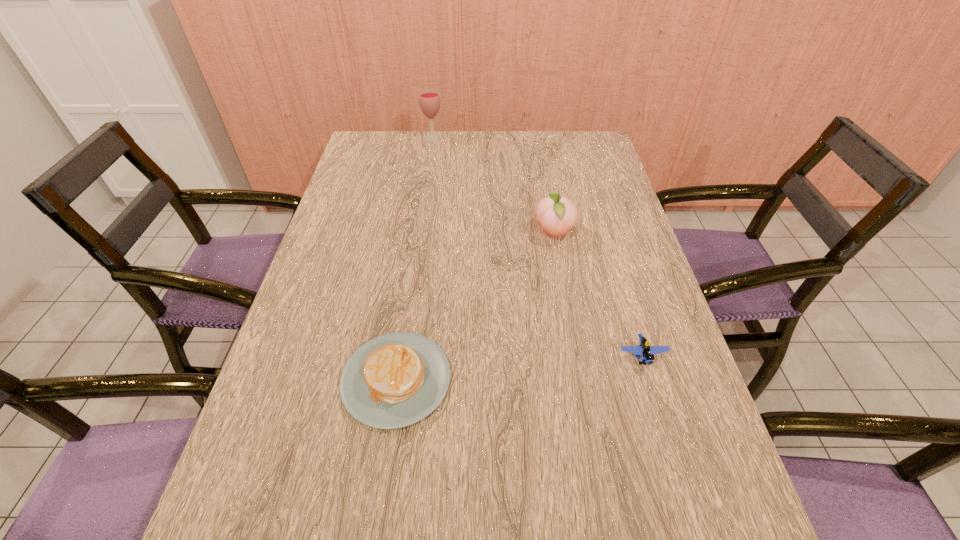
The width and height of the screenshot is (960, 540). Find the location of `wineglass`. wineglass is located at coordinates (429, 100).

Locate an element on the screen. the farthest object is located at coordinates (429, 100).

Find the location of a particular element. Image resolution: width=960 pixels, height=540 pixels. the second farthest object is located at coordinates (557, 215).

Locate an element on the screen. the third shortest object is located at coordinates (557, 215).

The height and width of the screenshot is (540, 960). I want to click on the rightmost object, so tap(644, 350).

Where is `pancake`? pancake is located at coordinates (394, 380).

Where is `vacant space located on the left of the tallest object`? The height and width of the screenshot is (540, 960). vacant space located on the left of the tallest object is located at coordinates (397, 138).

You are a GUI agent. You are given a task and a screenshot of the screen. Output one action in this format:
    pyautogui.click(x=<x>, y=<y>)
    Task: Click on the free space located on the back of the second farthest object
    
    Given the screenshot: What is the action you would take?
    pyautogui.click(x=541, y=166)

Locate an element on the screen. This screenshot has height=540, width=960. vacant space situated on the front-facing side of the Lego is located at coordinates (675, 465).

Locate an element on the screen. The width and height of the screenshot is (960, 540). free point located 0.260m on the back of the pancake is located at coordinates (415, 256).